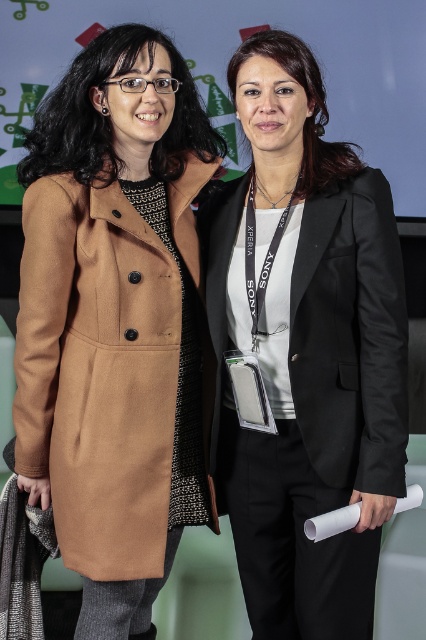
You are attending a tech conference and see two presenters. One is wearing a matte brown coat at left, and the other has a black satin blazer at right. Which presenter is standing to the left of the other?

A: The matte brown coat at left is positioned on the left side of black satin blazer at right, so the presenter in the matte brown coat at left is standing to the left of the presenter in the black satin blazer at right.

You are standing in front of a presentation screen and see the matte brown coat at left. If you want to touch the coat, where should you move your hand relative to the screen?

The matte brown coat at left is located at the 2D coordinates point [115,323], so you should move your hand to that position relative to the screen.